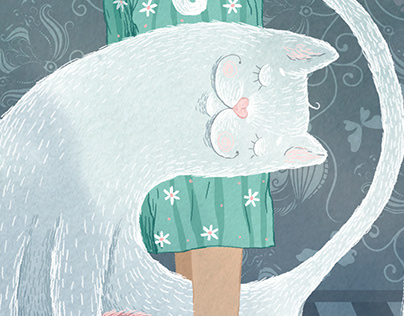
Image resolution: width=404 pixels, height=316 pixels. Find the location of `blue wallpaper`. blue wallpaper is located at coordinates (310, 218).